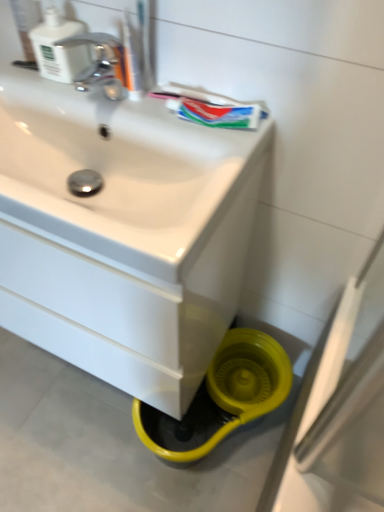
Question: Can you confirm if green matte toothpaste at upper center is positioned to the right of translucent plastic toothbrush at upper center?

Choices:
 (A) yes
 (B) no

Answer: (A)

Question: Could you tell me if green matte toothpaste at upper center is turned towards translucent plastic toothbrush at upper center?

Choices:
 (A) yes
 (B) no

Answer: (B)

Question: Is the position of green matte toothpaste at upper center less distant than that of translucent plastic toothbrush at upper center?

Choices:
 (A) no
 (B) yes

Answer: (A)

Question: Is green matte toothpaste at upper center to the left of translucent plastic toothbrush at upper center from the viewer's perspective?

Choices:
 (A) yes
 (B) no

Answer: (B)

Question: Considering the relative sizes of green matte toothpaste at upper center and translucent plastic toothbrush at upper center in the image provided, is green matte toothpaste at upper center shorter than translucent plastic toothbrush at upper center?

Choices:
 (A) no
 (B) yes

Answer: (B)

Question: From a real-world perspective, is white glossy sink at center above or below translucent plastic toothbrush at upper center?

Choices:
 (A) above
 (B) below

Answer: (B)

Question: Is white glossy sink at center spatially inside translucent plastic toothbrush at upper center, or outside of it?

Choices:
 (A) inside
 (B) outside

Answer: (B)

Question: From the image's perspective, is white glossy sink at center positioned above or below translucent plastic toothbrush at upper center?

Choices:
 (A) below
 (B) above

Answer: (A)

Question: Considering the positions of white glossy sink at center and translucent plastic toothbrush at upper center in the image, is white glossy sink at center bigger or smaller than translucent plastic toothbrush at upper center?

Choices:
 (A) small
 (B) big

Answer: (B)

Question: From a real-world perspective, is white plastic soap dispenser at upper left physically located above or below white glossy sink at center?

Choices:
 (A) above
 (B) below

Answer: (A)

Question: In the image, is white plastic soap dispenser at upper left positioned in front of or behind white glossy sink at center?

Choices:
 (A) front
 (B) behind

Answer: (B)

Question: Is white plastic soap dispenser at upper left to the left or to the right of white glossy sink at center in the image?

Choices:
 (A) right
 (B) left

Answer: (B)

Question: Is white plastic soap dispenser at upper left inside the boundaries of white glossy sink at center, or outside?

Choices:
 (A) inside
 (B) outside

Answer: (B)

Question: Considering the relative positions of white plastic soap dispenser at upper left and green matte toothpaste at upper center in the image provided, is white plastic soap dispenser at upper left to the left or to the right of green matte toothpaste at upper center?

Choices:
 (A) left
 (B) right

Answer: (A)

Question: From the image's perspective, is white plastic soap dispenser at upper left positioned above or below green matte toothpaste at upper center?

Choices:
 (A) above
 (B) below

Answer: (A)